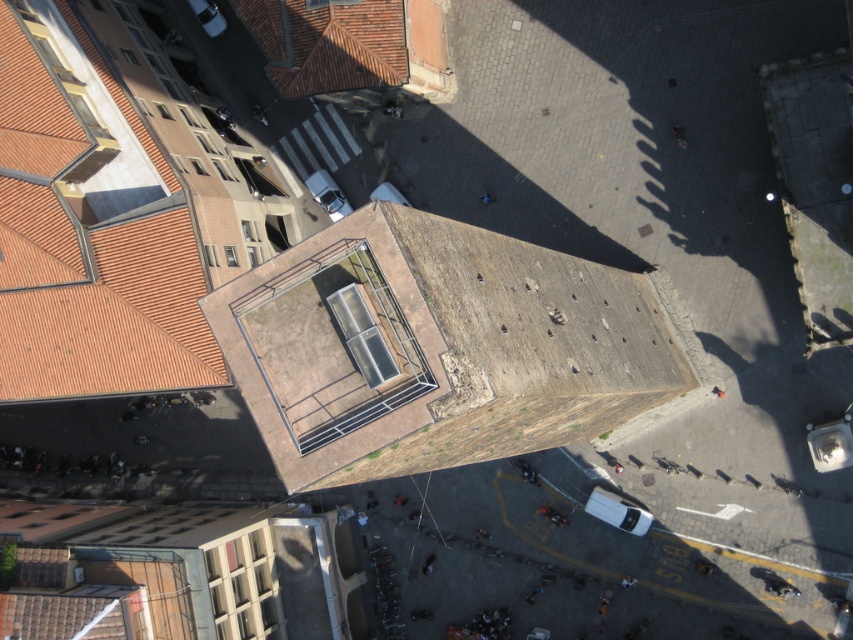
Does brown textured roof at center come in front of terracotta tiles at upper left?

Yes, brown textured roof at center is in front of terracotta tiles at upper left.

Can you confirm if brown textured roof at center is positioned below terracotta tiles at upper left?

Correct, brown textured roof at center is located below terracotta tiles at upper left.

Is point (396, 268) positioned before point (286, 67)?

Yes.

Find the location of a particular element. The height and width of the screenshot is (640, 853). brown textured roof at center is located at coordinates (434, 348).